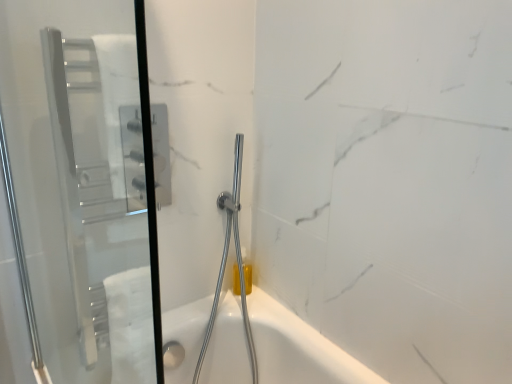
Question: From a real-world perspective, is transparent glass screen door at left positioned above or below chrome metallic shower head at center?

Choices:
 (A) above
 (B) below

Answer: (A)

Question: Is transparent glass screen door at left taller or shorter than chrome metallic shower head at center?

Choices:
 (A) tall
 (B) short

Answer: (B)

Question: Is point (40, 347) positioned closer to the camera than point (209, 319)?

Choices:
 (A) farther
 (B) closer

Answer: (B)

Question: From their relative heights in the image, would you say chrome metallic shower head at center is taller or shorter than transparent glass screen door at left?

Choices:
 (A) short
 (B) tall

Answer: (B)

Question: Considering the positions of chrome metallic shower head at center and transparent glass screen door at left in the image, is chrome metallic shower head at center bigger or smaller than transparent glass screen door at left?

Choices:
 (A) small
 (B) big

Answer: (B)

Question: Considering the relative positions of chrome metallic shower head at center and transparent glass screen door at left in the image provided, is chrome metallic shower head at center to the left or to the right of transparent glass screen door at left?

Choices:
 (A) left
 (B) right

Answer: (B)

Question: Is chrome metallic shower head at center wider or thinner than transparent glass screen door at left?

Choices:
 (A) wide
 (B) thin

Answer: (A)